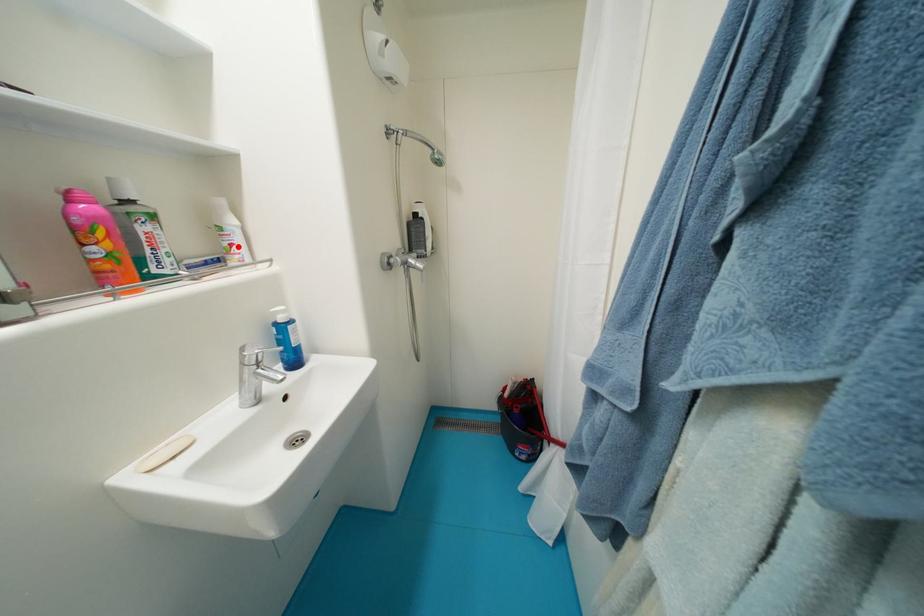
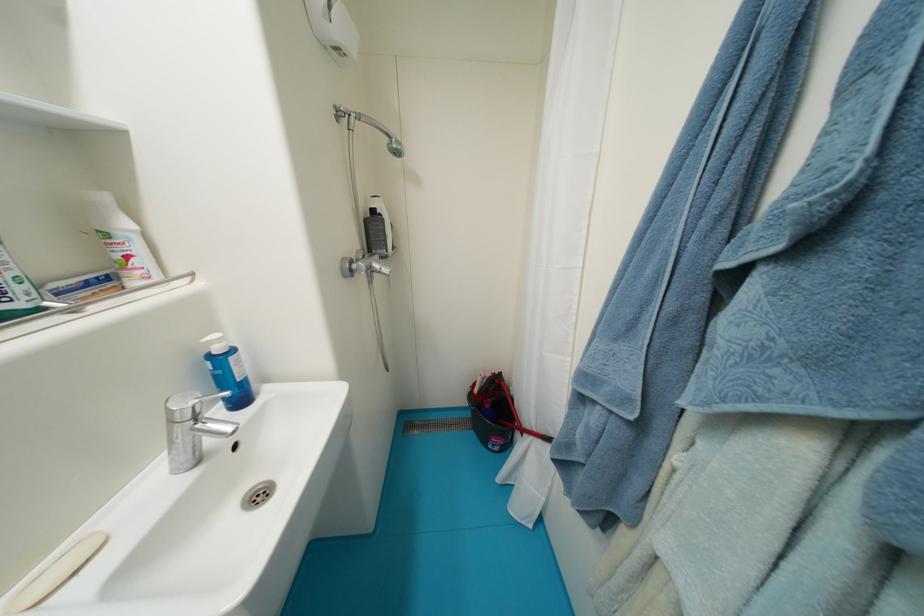
In the second image, find the point that corresponds to the highlighted location in the first image.

(134, 259)